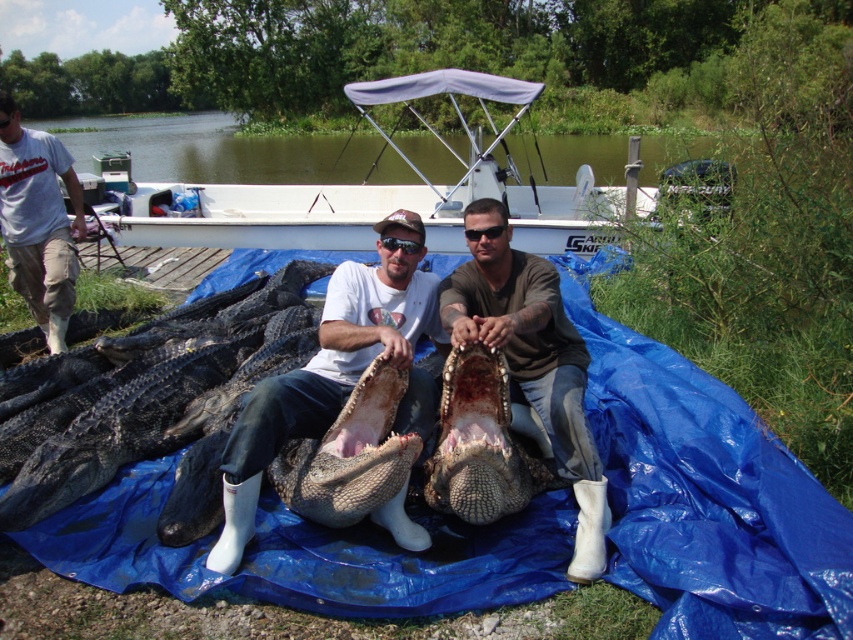
Question: Is white rubber boots at center wider than white cotton shirt at left?

Choices:
 (A) yes
 (B) no

Answer: (B)

Question: Does dark scaly crocodile at center appear on the right side of black matte sunglasses at center?

Choices:
 (A) no
 (B) yes

Answer: (A)

Question: Among these points, which one is nearest to the camera?

Choices:
 (A) (42, 461)
 (B) (67, 177)

Answer: (A)

Question: Among these objects, which one is nearest to the camera?

Choices:
 (A) white cotton shirt at left
 (B) white plastic boat at upper center
 (C) black matte sunglasses at center
 (D) white rubber boots at center

Answer: (D)

Question: Which object is positioned farthest from the dark scaly crocodile at center?

Choices:
 (A) white rubber boots at center
 (B) brown leather boots at center
 (C) black matte sunglasses at center
 (D) white plastic boat at upper center

Answer: (D)

Question: Is dark scaly crocodile at center further to the viewer compared to white cotton shirt at left?

Choices:
 (A) yes
 (B) no

Answer: (B)